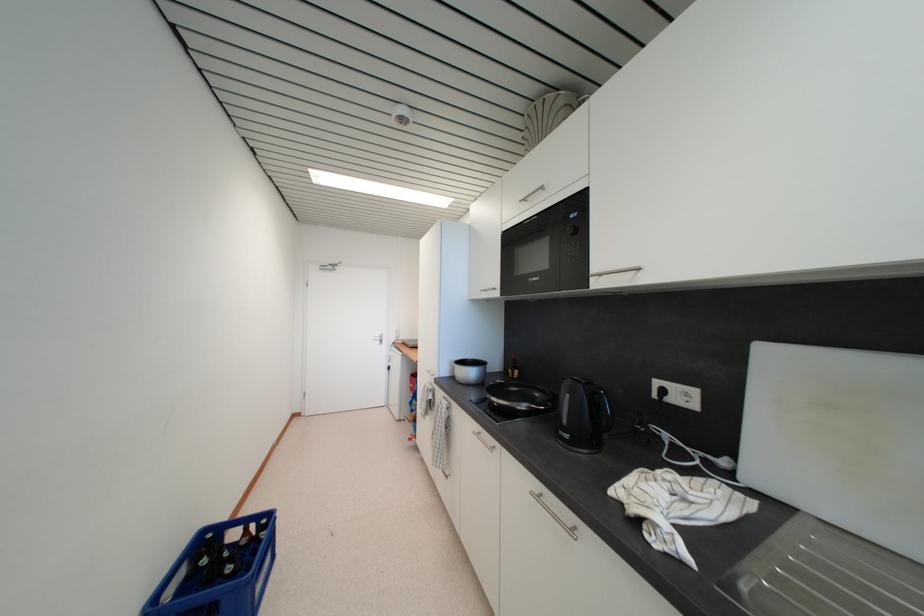
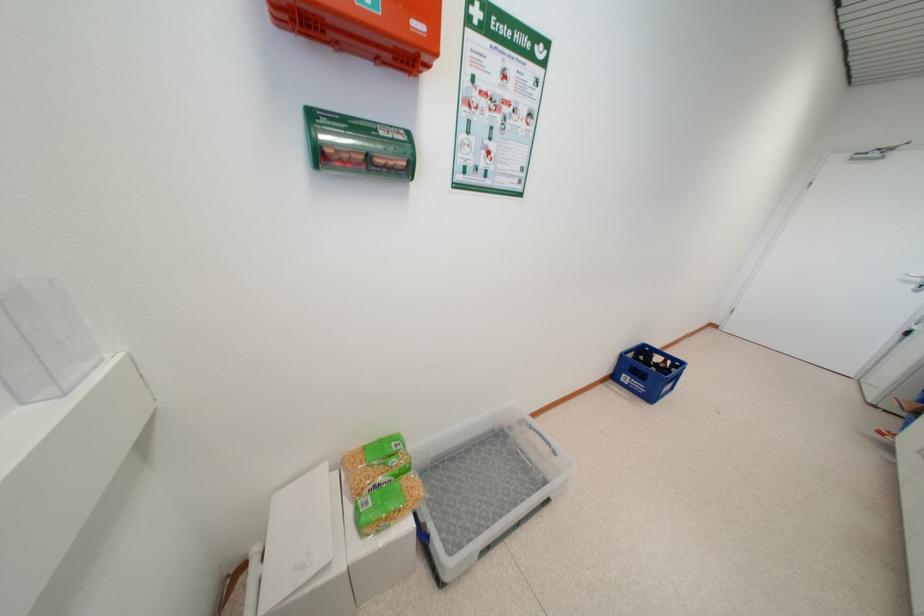
The point at (x=251, y=533) is marked in the first image. Where is the corresponding point in the second image?

(669, 363)